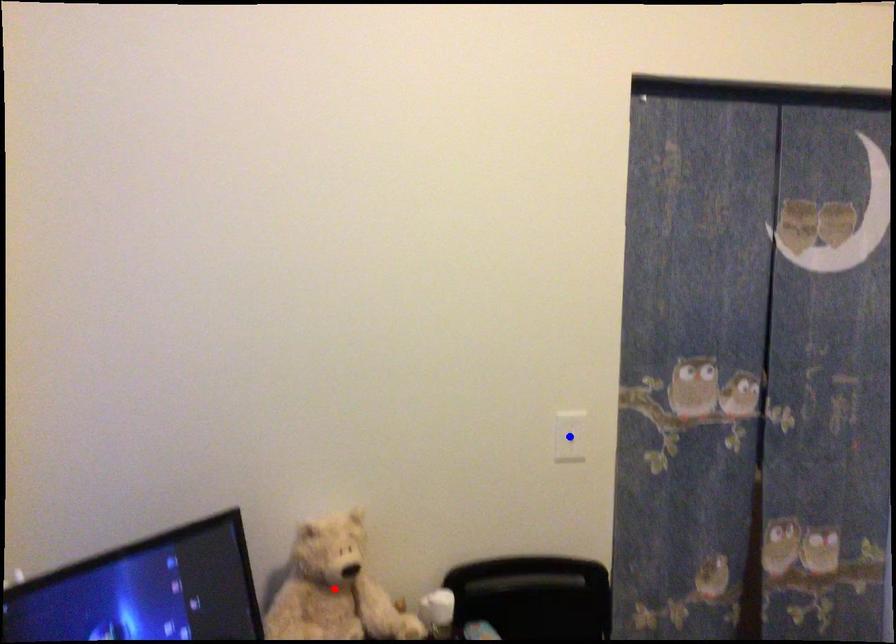
Question: Which of the two points in the image is closer to the camera?

Choices:
 (A) Blue point is closer.
 (B) Red point is closer.

Answer: (B)